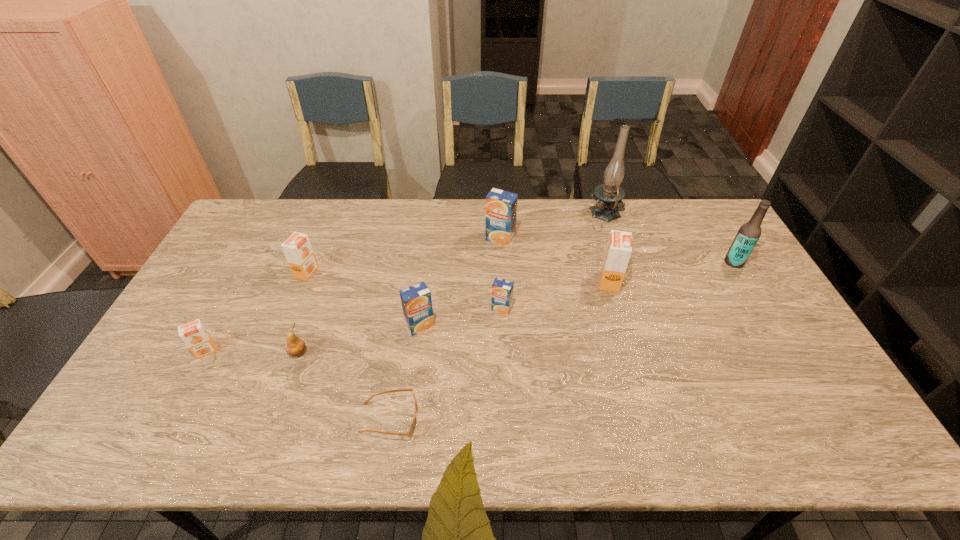
Locate an element on the screen. This screenshot has height=540, width=960. oil lamp is located at coordinates (610, 195).

What are the coordinates of `the tallest object` in the screenshot? It's located at (610, 195).

You are a GUI agent. You are given a task and a screenshot of the screen. Output one action in this format:
    pyautogui.click(x=<x>, y=<y>)
    Task: Click on the ninth shortest object
    
    Given the screenshot: What is the action you would take?
    pyautogui.click(x=749, y=233)

Find the location of a particular element. the rightmost object is located at coordinates (749, 233).

The height and width of the screenshot is (540, 960). What are the coordinates of `the ninth nearest object` in the screenshot? It's located at (501, 206).

The image size is (960, 540). I want to click on the farthest orange juice, so click(x=501, y=206).

Where is `the rightmost orange juice`? The image size is (960, 540). the rightmost orange juice is located at coordinates (619, 248).

Locate an element on the screen. the biggest orange orange juice is located at coordinates (619, 248).

Find the location of a particular element. the seventh farthest object is located at coordinates (416, 301).

Find the location of a particular element. This screenshot has width=960, height=540. the fifth farthest orange juice is located at coordinates (416, 301).